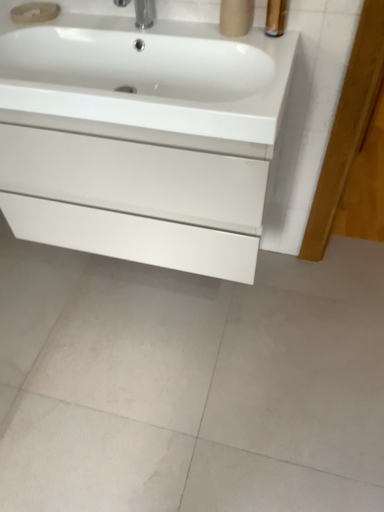
What do you see at coordinates (135, 59) in the screenshot? I see `white glossy sink at upper center` at bounding box center [135, 59].

Identify the location of white glossy sink at upper center. Image resolution: width=384 pixels, height=512 pixels. (135, 59).

What do you see at coordinates (141, 139) in the screenshot?
I see `white glossy cabinet at center` at bounding box center [141, 139].

Find the location of a particular element. white glossy cabinet at center is located at coordinates (141, 139).

Locate an element on the screen. white glossy sink at upper center is located at coordinates (135, 59).

Can you confirm if white glossy cabinet at center is positioned to the left of white glossy sink at upper center?

In fact, white glossy cabinet at center is to the right of white glossy sink at upper center.

Which is behind, white glossy cabinet at center or white glossy sink at upper center?

white glossy cabinet at center is more distant.

Is point (76, 84) farther from camera compared to point (80, 38)?

No, (76, 84) is closer to viewer.

From the image's perspective, is white glossy cabinet at center below white glossy sink at upper center?

Correct, white glossy cabinet at center appears lower than white glossy sink at upper center in the image.

From a real-world perspective, is white glossy cabinet at center positioned above or below white glossy sink at upper center?

From a real-world perspective, white glossy cabinet at center is physically below white glossy sink at upper center.

Consider the image. Considering the relative sizes of white glossy cabinet at center and white glossy sink at upper center in the image provided, is white glossy cabinet at center thinner than white glossy sink at upper center?

Correct, the width of white glossy cabinet at center is less than that of white glossy sink at upper center.

Considering the sizes of objects white glossy cabinet at center and white glossy sink at upper center in the image provided, who is shorter, white glossy cabinet at center or white glossy sink at upper center?

Standing shorter between the two is white glossy sink at upper center.

Who is smaller, white glossy cabinet at center or white glossy sink at upper center?

With smaller size is white glossy sink at upper center.

Is white glossy cabinet at center completely or partially outside of white glossy sink at upper center?

white glossy cabinet at center lies outside white glossy sink at upper center's area.

Would you consider white glossy cabinet at center to be distant from white glossy sink at upper center?

That's not correct — white glossy cabinet at center is a little close to white glossy sink at upper center.

Is white glossy cabinet at center oriented towards white glossy sink at upper center?

No.

The height and width of the screenshot is (512, 384). Find the location of `bathroom cabinet below the white glossy sink at upper center (from the image's perspective)`. bathroom cabinet below the white glossy sink at upper center (from the image's perspective) is located at coordinates (141, 139).

In the scene shown: Is white glossy sink at upper center at the right side of white glossy cabinet at center?

No.

Between white glossy sink at upper center and white glossy cabinet at center, which one is positioned behind?

white glossy cabinet at center.

Does point (83, 32) lie in front of point (263, 105)?

No, it is behind (263, 105).

From the image's perspective, is white glossy sink at upper center located beneath white glossy cabinet at center?

No, from the image's perspective, white glossy sink at upper center is not beneath white glossy cabinet at center.

From a real-world perspective, who is located higher, white glossy sink at upper center or white glossy cabinet at center?

white glossy sink at upper center, from a real-world perspective.

Is white glossy sink at upper center wider or thinner than white glossy cabinet at center?

Clearly, white glossy sink at upper center has more width compared to white glossy cabinet at center.

Does white glossy sink at upper center have a greater height compared to white glossy cabinet at center?

No, white glossy sink at upper center is not taller than white glossy cabinet at center.

Between white glossy sink at upper center and white glossy cabinet at center, which one has larger size?

white glossy cabinet at center is bigger.

Do you think white glossy sink at upper center is within white glossy cabinet at center, or outside of it?

white glossy sink at upper center is not inside white glossy cabinet at center, it's outside.

Consider the image. Is white glossy sink at upper center not near white glossy cabinet at center?

That's not correct — white glossy sink at upper center is a little close to white glossy cabinet at center.

Is white glossy sink at upper center oriented towards white glossy cabinet at center?

No, white glossy sink at upper center is not facing towards white glossy cabinet at center.

At what (x,y) coordinates should I click in order to perform the action: click on bathroom cabinet behind the white glossy sink at upper center. Please return your answer as a coordinate pair (x, y). Looking at the image, I should click on [141, 139].

I want to click on sink above the white glossy cabinet at center (from a real-world perspective), so click(x=135, y=59).

This screenshot has width=384, height=512. Find the location of `sink above the white glossy cabinet at center (from the image's perspective)`. sink above the white glossy cabinet at center (from the image's perspective) is located at coordinates (135, 59).